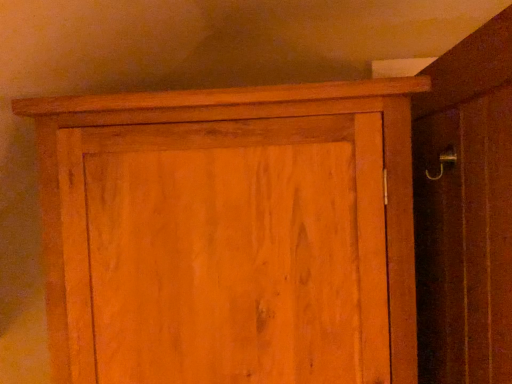
Question: In the image, is wooden screen door at right positioned in front of or behind wooden cupboard at upper center?

Choices:
 (A) behind
 (B) front

Answer: (B)

Question: Is wooden screen door at right situated inside wooden cupboard at upper center or outside?

Choices:
 (A) outside
 (B) inside

Answer: (A)

Question: Looking at their shapes, would you say wooden screen door at right is wider or thinner than wooden cupboard at upper center?

Choices:
 (A) wide
 (B) thin

Answer: (B)

Question: Relative to wooden screen door at right, is wooden cupboard at upper center in front or behind?

Choices:
 (A) behind
 (B) front

Answer: (A)

Question: Is wooden cupboard at upper center bigger or smaller than wooden screen door at right?

Choices:
 (A) small
 (B) big

Answer: (B)

Question: From a real-world perspective, is wooden cupboard at upper center physically located above or below wooden screen door at right?

Choices:
 (A) below
 (B) above

Answer: (A)

Question: Considering the positions of wooden cupboard at upper center and wooden screen door at right in the image, is wooden cupboard at upper center taller or shorter than wooden screen door at right?

Choices:
 (A) tall
 (B) short

Answer: (B)